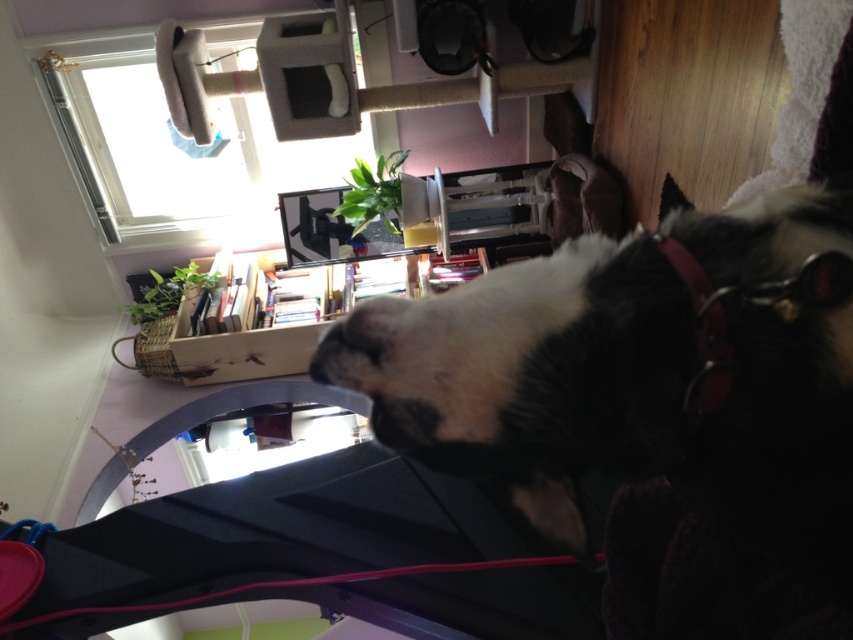
Question: Can you confirm if black fuzzy dog at center is positioned below white fur nose at center?

Choices:
 (A) yes
 (B) no

Answer: (A)

Question: Among these objects, which one is farthest from the camera?

Choices:
 (A) white fur nose at center
 (B) black fuzzy dog at center
 (C) leather-like red collar at center right

Answer: (A)

Question: Which object is farther from the camera taking this photo?

Choices:
 (A) leather-like red collar at center right
 (B) white fur nose at center

Answer: (B)

Question: Is leather-like red collar at center right to the right of white fur nose at center from the viewer's perspective?

Choices:
 (A) no
 (B) yes

Answer: (B)

Question: Which of these objects is positioned farthest from the black fuzzy dog at center?

Choices:
 (A) leather-like red collar at center right
 (B) white fur nose at center

Answer: (B)

Question: In this image, where is black fuzzy dog at center located relative to white fur nose at center?

Choices:
 (A) right
 (B) left

Answer: (A)